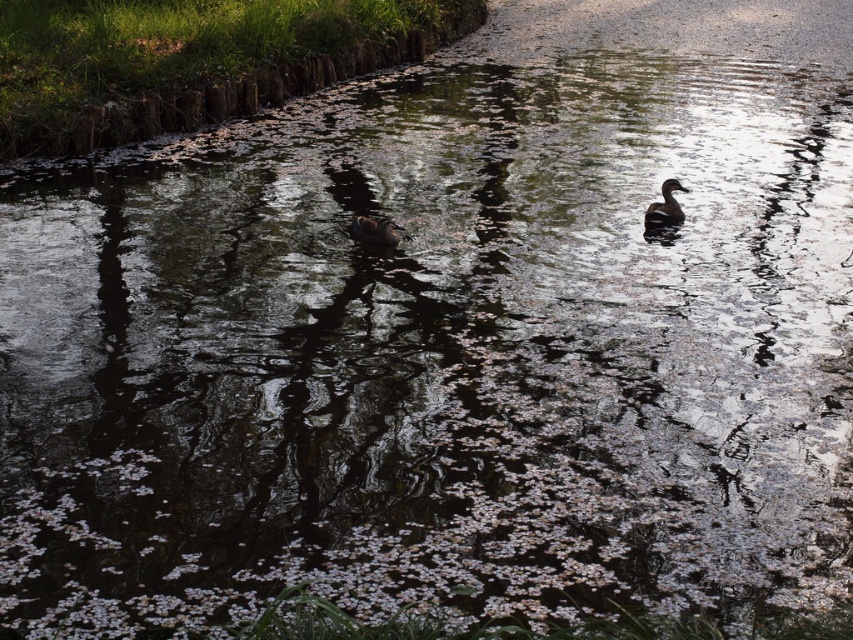
Question: Which point appears closest to the camera in this image?

Choices:
 (A) coord(680,211)
 (B) coord(398,240)

Answer: (B)

Question: Does dark brown feathers at center come behind dark brown glossy duck at center?

Choices:
 (A) yes
 (B) no

Answer: (B)

Question: Can you confirm if dark brown feathers at center is positioned to the right of dark brown glossy duck at center?

Choices:
 (A) no
 (B) yes

Answer: (A)

Question: Does dark brown feathers at center have a larger size compared to dark brown glossy duck at center?

Choices:
 (A) yes
 (B) no

Answer: (B)